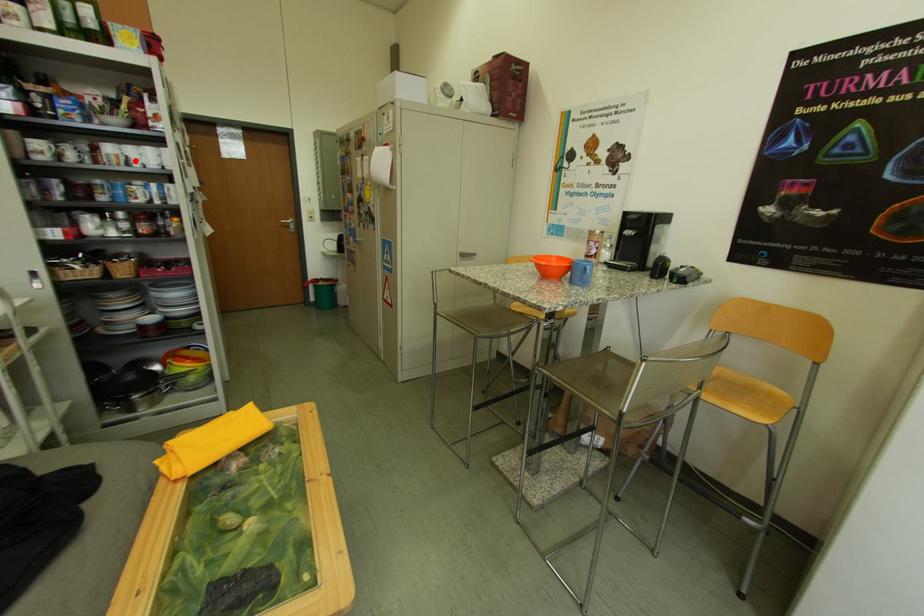
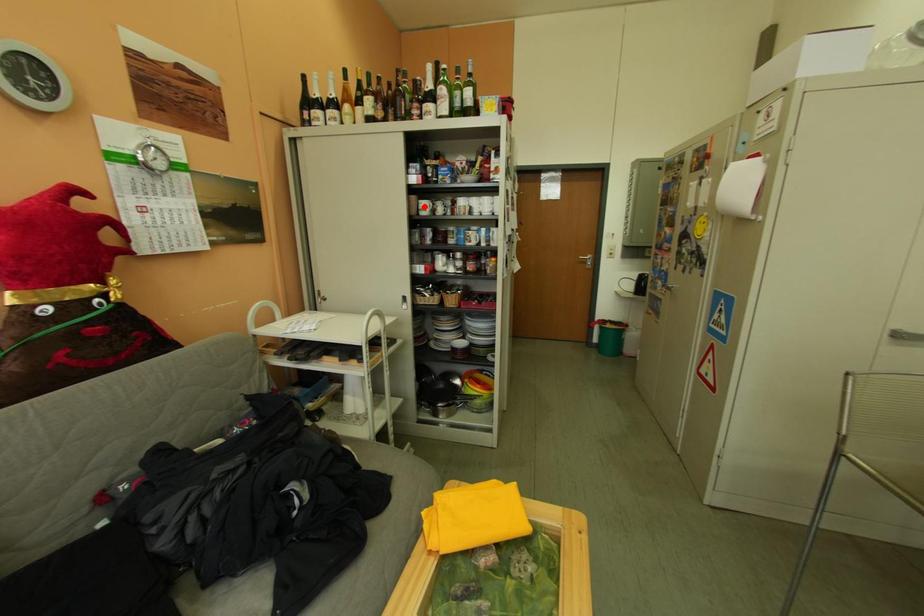
Consider the image. I am providing you with two images of the same scene from different viewpoints. A red point is marked on the first image and another point is marked on the second image. Is the red point in image1 aligned with the point shown in image2?

No